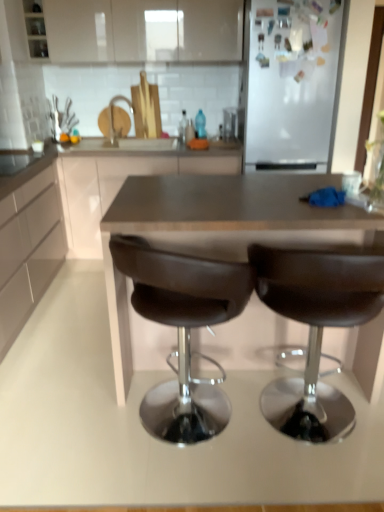
Question: Is brown leather chair at center, which ranks as the 1th chair in left-to-right order, to the right of white glossy cabinet at upper center, marked as the 1th cabinetry in a top-to-bottom arrangement, from the viewer's perspective?

Choices:
 (A) yes
 (B) no

Answer: (A)

Question: From a real-world perspective, is brown leather chair at center, which ranks as the 1th chair in left-to-right order, physically below white glossy cabinet at upper center, which appears as the 3th cabinetry when ordered from the bottom?

Choices:
 (A) yes
 (B) no

Answer: (A)

Question: Is brown leather chair at center, which ranks as the 1th chair in left-to-right order, at the left side of white glossy cabinet at upper center, marked as the 1th cabinetry in a top-to-bottom arrangement?

Choices:
 (A) yes
 (B) no

Answer: (B)

Question: Is brown leather chair at center, which is the second chair in right-to-left order, oriented away from white glossy cabinet at upper center, marked as the 1th cabinetry in a top-to-bottom arrangement?

Choices:
 (A) yes
 (B) no

Answer: (B)

Question: Would you say brown leather chair at center, which ranks as the 1th chair in left-to-right order, contains white glossy cabinet at upper center, which appears as the 3th cabinetry when ordered from the bottom?

Choices:
 (A) no
 (B) yes

Answer: (A)

Question: Is matte brown countertop at center, the 2th cabinetry from the top, in front of or behind brushed metal faucet at upper center in the image?

Choices:
 (A) front
 (B) behind

Answer: (A)

Question: From a real-world perspective, is matte brown countertop at center, the 2th cabinetry from the top, physically located above or below brushed metal faucet at upper center?

Choices:
 (A) above
 (B) below

Answer: (B)

Question: From their relative heights in the image, would you say matte brown countertop at center, the 2th cabinetry when ordered from bottom to top, is taller or shorter than brushed metal faucet at upper center?

Choices:
 (A) tall
 (B) short

Answer: (A)

Question: From the image's perspective, is matte brown countertop at center, the 2th cabinetry from the top, located above or below brushed metal faucet at upper center?

Choices:
 (A) below
 (B) above

Answer: (A)

Question: Is brown leather chair at center, which ranks as the 1th chair in left-to-right order, taller or shorter than white matte cabinet at left, the 3th cabinetry from the top?

Choices:
 (A) tall
 (B) short

Answer: (B)

Question: From a real-world perspective, relative to white matte cabinet at left, the first cabinetry ordered from the bottom, is brown leather chair at center, which ranks as the 1th chair in left-to-right order, vertically above or below?

Choices:
 (A) below
 (B) above

Answer: (A)

Question: In terms of size, does brown leather chair at center, which is the second chair in right-to-left order, appear bigger or smaller than white matte cabinet at left, the 3th cabinetry from the top?

Choices:
 (A) small
 (B) big

Answer: (A)

Question: In the image, is brown leather chair at center, which is the second chair in right-to-left order, positioned in front of or behind white matte cabinet at left, the first cabinetry ordered from the bottom?

Choices:
 (A) front
 (B) behind

Answer: (A)

Question: Considering their positions, is brushed metal faucet at upper center located in front of or behind white glossy cabinet at upper center, which appears as the 3th cabinetry when ordered from the bottom?

Choices:
 (A) behind
 (B) front

Answer: (A)

Question: From the image's perspective, is brushed metal faucet at upper center positioned above or below white glossy cabinet at upper center, marked as the 1th cabinetry in a top-to-bottom arrangement?

Choices:
 (A) below
 (B) above

Answer: (A)